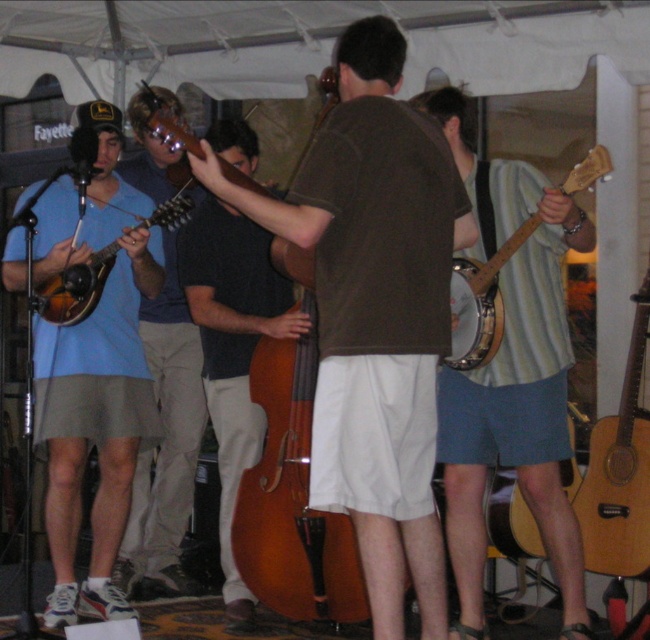
Does wooden banjo at center-right have a smaller size compared to wooden acoustic guitar at lower right?

No.

Is point (448, 285) closer to camera compared to point (512, 504)?

Yes, point (448, 285) is in front of point (512, 504).

Where is `wooden banjo at center-right`? The height and width of the screenshot is (640, 650). wooden banjo at center-right is located at coordinates (481, 301).

Is acoustic wood guitar at right thinner than wooden mandolin at left?

Yes, acoustic wood guitar at right is thinner than wooden mandolin at left.

Can you confirm if acoustic wood guitar at right is wider than wooden mandolin at left?

No.

Identify the location of acoustic wood guitar at right. This screenshot has width=650, height=640. (619, 472).

Who is positioned more to the left, brown wooden cello at center or wooden banjo at center-right?

Positioned to the left is brown wooden cello at center.

Measure the distance between brown wooden cello at center and wooden banjo at center-right.

They are 89.06 centimeters apart.

Who is more distant from viewer, (234, 536) or (454, 301)?

Point (234, 536)

You are a GUI agent. You are given a task and a screenshot of the screen. Output one action in this format:
    pyautogui.click(x=<x>, y=<y>)
    Task: Click on the brown wooden cello at center
    This screenshot has height=640, width=650.
    Given the screenshot: What is the action you would take?
    pyautogui.click(x=292, y=481)